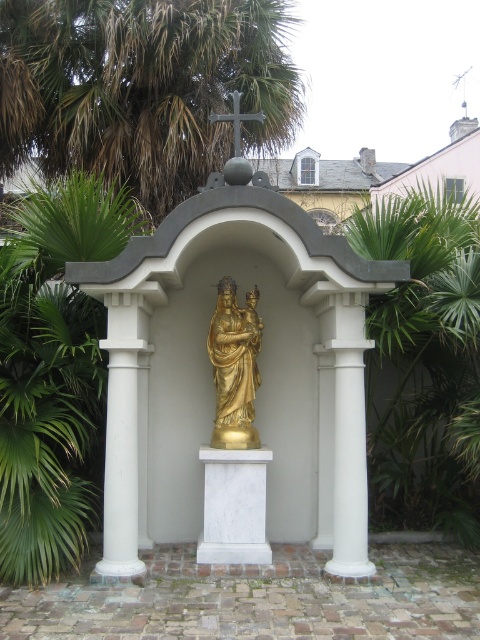
You are an architect designing a new garden shrine. The existing shrine has a white marble column at center and a gold polished statue at center. Which object is bigger in size?

The white marble column at center is larger in size than the gold polished statue at center.

You are a photographer planning to take a picture of the gold polished statue at center and the green leafy palm tree at center. Based on their sizes, which one should you focus on to ensure it fills the frame more appropriately?

The green leafy palm tree at center is larger than the gold polished statue at center, so focusing on it will fill the frame more appropriately.